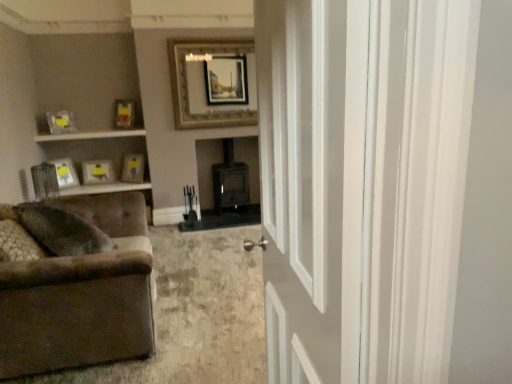
Question: Can you confirm if matte yellow picture frame at upper left, the 4th picture frame viewed from the left, is thinner than matte silver picture frame at left, the first picture frame viewed from the left?

Choices:
 (A) yes
 (B) no

Answer: (B)

Question: Considering the relative sizes of matte yellow picture frame at upper left, the 4th picture frame viewed from the left, and matte silver picture frame at left, the first picture frame viewed from the left, in the image provided, is matte yellow picture frame at upper left, the 4th picture frame viewed from the left, smaller than matte silver picture frame at left, the first picture frame viewed from the left,?

Choices:
 (A) no
 (B) yes

Answer: (A)

Question: Considering the relative positions of matte yellow picture frame at upper left, the 4th picture frame viewed from the left, and matte silver picture frame at left, the 6th picture frame when ordered from right to left, in the image provided, is matte yellow picture frame at upper left, the 4th picture frame viewed from the left, to the left of matte silver picture frame at left, the 6th picture frame when ordered from right to left, from the viewer's perspective?

Choices:
 (A) no
 (B) yes

Answer: (A)

Question: Is matte silver picture frame at left, the first picture frame viewed from the left, inside matte yellow picture frame at upper left, which is counted as the third picture frame, starting from the right?

Choices:
 (A) yes
 (B) no

Answer: (B)

Question: Is matte yellow picture frame at upper left, the 4th picture frame viewed from the left, shorter than matte silver picture frame at left, the 6th picture frame when ordered from right to left?

Choices:
 (A) yes
 (B) no

Answer: (A)

Question: Relative to matte yellow picture frame at upper left, acting as the second picture frame starting from the left, is white glossy door at center in front or behind?

Choices:
 (A) behind
 (B) front

Answer: (B)

Question: In terms of width, does white glossy door at center look wider or thinner when compared to matte yellow picture frame at upper left, acting as the second picture frame starting from the left?

Choices:
 (A) wide
 (B) thin

Answer: (A)

Question: From the image's perspective, is white glossy door at center above or below matte yellow picture frame at upper left, the 5th picture frame viewed from the right?

Choices:
 (A) below
 (B) above

Answer: (A)

Question: In the image, is white glossy door at center on the left side or the right side of matte yellow picture frame at upper left, acting as the second picture frame starting from the left?

Choices:
 (A) left
 (B) right

Answer: (B)

Question: Considering the positions of brown fabric couch at lower left and matte yellow picture frame at center, marked as the fifth picture frame in a left-to-right arrangement, in the image, is brown fabric couch at lower left taller or shorter than matte yellow picture frame at center, marked as the fifth picture frame in a left-to-right arrangement,?

Choices:
 (A) tall
 (B) short

Answer: (A)

Question: From a real-world perspective, is brown fabric couch at lower left above or below matte yellow picture frame at center, marked as the fifth picture frame in a left-to-right arrangement?

Choices:
 (A) above
 (B) below

Answer: (B)

Question: Which is correct: brown fabric couch at lower left is inside matte yellow picture frame at center, marked as the fifth picture frame in a left-to-right arrangement, or outside of it?

Choices:
 (A) inside
 (B) outside

Answer: (B)

Question: Considering the positions of point (103, 223) and point (136, 178), is point (103, 223) closer or farther from the camera than point (136, 178)?

Choices:
 (A) farther
 (B) closer

Answer: (B)

Question: In terms of size, does brown fabric couch at lower left appear bigger or smaller than matte silver picture frame at left, the 6th picture frame when ordered from right to left?

Choices:
 (A) small
 (B) big

Answer: (B)

Question: From a real-world perspective, is brown fabric couch at lower left positioned above or below matte silver picture frame at left, the first picture frame viewed from the left?

Choices:
 (A) below
 (B) above

Answer: (A)